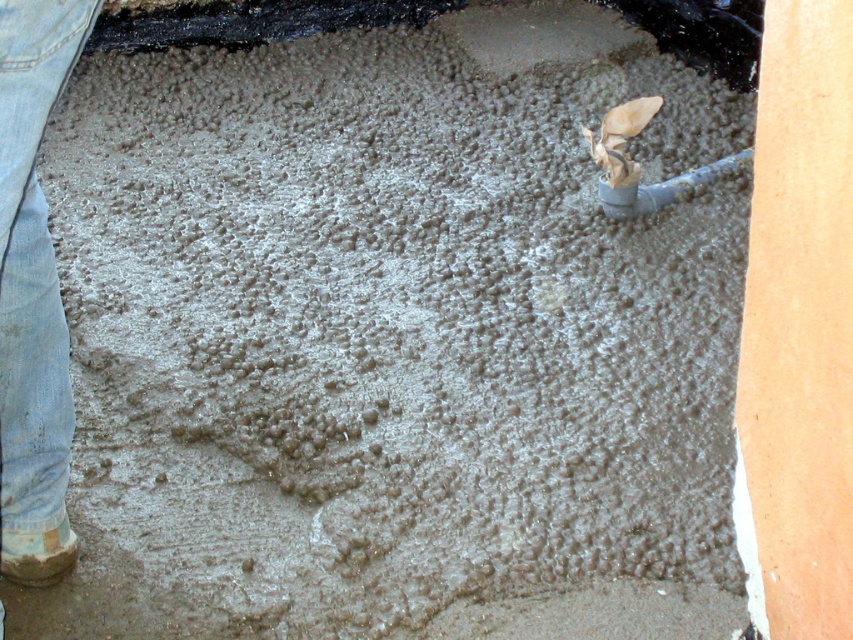
You are standing at the center of the concrete floor and want to move to the denim jeans at lower left. Which direction should you walk to reach them?

To reach the denim jeans at lower left, you should walk towards the lower left direction since that is where the denim jeans are located.

You are a construction worker standing on the freshly poured concrete floor. You need to move from your current position to the pipe in the upper right corner. There are denim jeans at lower left and a brown fur chihuahua at upper center in your way. Which object is closer to your starting position?

The denim jeans at lower left is closer to your starting position because it is to the left of the brown fur chihuahua at upper center, meaning it is nearer to the lower left area where you are standing.